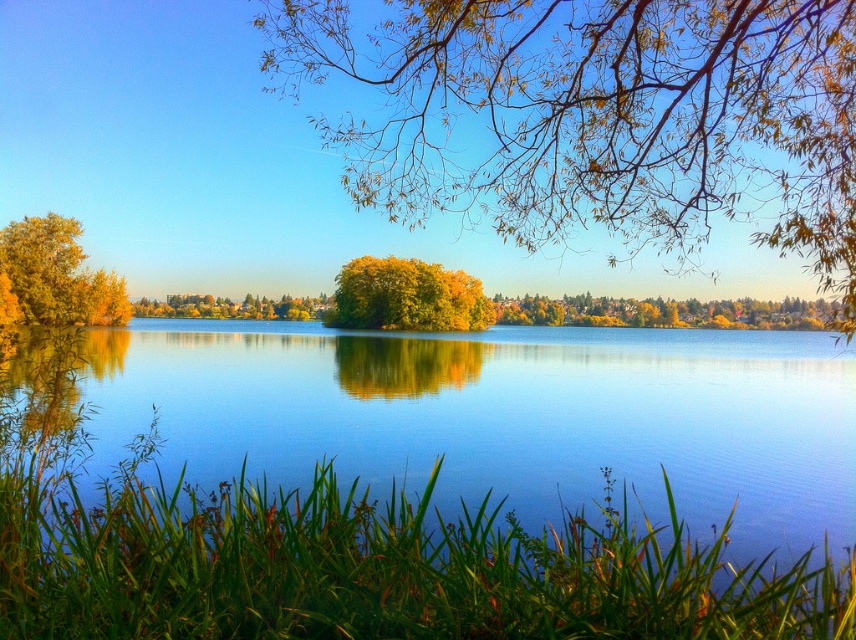
At what (x,y) coordinates should I click in order to perform the action: click on yellow-green foliage at center. Please return your answer as a coordinate pair (x, y). The width and height of the screenshot is (856, 640). Looking at the image, I should click on (598, 115).

Between point (742, 182) and point (681, 522), which one is positioned behind?

The point (742, 182) is more distant.

Between point (728, 145) and point (283, 540), which one is positioned in front?

Point (283, 540) is in front.

This screenshot has width=856, height=640. Identify the location of yellow-green foliage at center. (598, 115).

Does yellow-green foliage at center have a lesser height compared to golden leafy tree at center?

Yes.

How far apart are yellow-green foliage at center and golden leafy tree at center?

yellow-green foliage at center is 211.47 feet from golden leafy tree at center.

You are a GUI agent. You are given a task and a screenshot of the screen. Output one action in this format:
    pyautogui.click(x=<x>, y=<y>)
    Task: Click on the yellow-green foliage at center
    The image size is (856, 640).
    Given the screenshot: What is the action you would take?
    pyautogui.click(x=598, y=115)

Between green leafy grass at lower center and golden yellow leaves at left, which one appears on the left side from the viewer's perspective?

golden yellow leaves at left is more to the left.

Describe the element at coordinates (364, 563) in the screenshot. I see `green leafy grass at lower center` at that location.

The image size is (856, 640). What are the coordinates of `green leafy grass at lower center` in the screenshot? It's located at (364, 563).